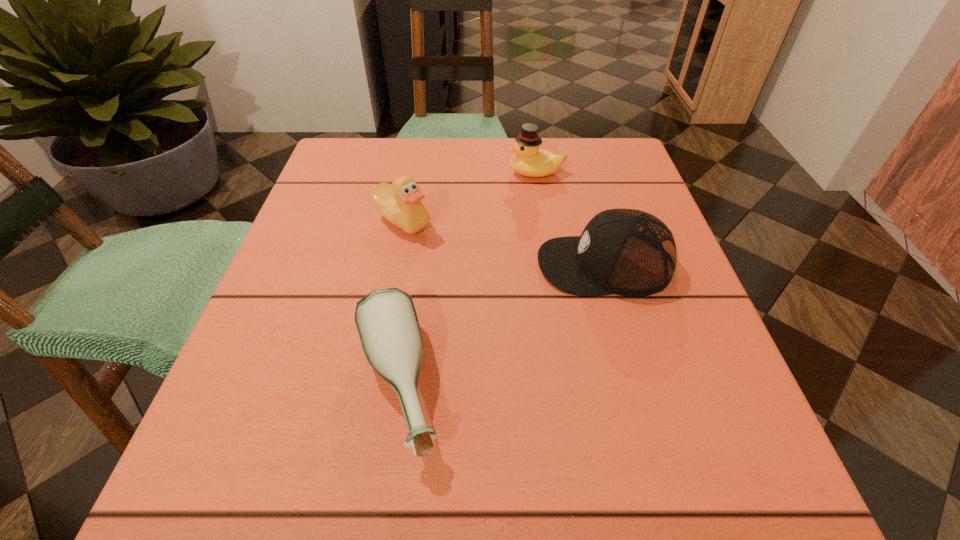
The width and height of the screenshot is (960, 540). I want to click on the farthest object, so click(529, 160).

Find the location of `the farther duck`. the farther duck is located at coordinates (529, 160).

I want to click on the left duck, so click(x=400, y=203).

Where is `cap`? The height and width of the screenshot is (540, 960). cap is located at coordinates (627, 252).

The width and height of the screenshot is (960, 540). Find the location of `the nearest object`. the nearest object is located at coordinates (386, 321).

At what (x,y) coordinates should I click in order to perform the action: click on bottle. Please return your answer as a coordinate pair (x, y). Looking at the image, I should click on pos(386,321).

Locate an element on the screen. The image size is (960, 540). vacant area situated 0.050m on the front-facing side of the farthest object is located at coordinates (484, 172).

I want to click on free region located 0.340m on the front-facing side of the farthest object, so click(x=354, y=172).

Find the location of a particular element. free space located on the front-facing side of the farthest object is located at coordinates (412, 172).

At what (x,y) coordinates should I click in order to perform the action: click on vacant space located 0.230m at the beak of the nearer duck. Please return your answer as a coordinate pair (x, y). Image resolution: width=960 pixels, height=540 pixels. Looking at the image, I should click on (379, 340).